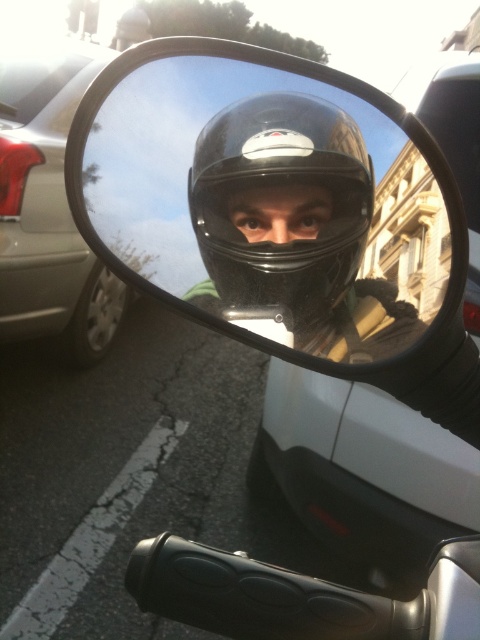
Is point (360, 109) in front of point (264, 218)?

Yes.

Between transparent plastic mirror at center and matte black helmet at center, which one is positioned higher?

transparent plastic mirror at center

What are the coordinates of `transparent plastic mirror at center` in the screenshot? It's located at (267, 188).

Is transparent plastic mirror at center thinner than black matte helmet at center?

In fact, transparent plastic mirror at center might be wider than black matte helmet at center.

Measure the distance between transparent plastic mirror at center and camera.

13.88 inches

Who is more forward, (157, 138) or (220, 177)?

Point (220, 177) is in front.

At what (x,y) coordinates should I click in order to perform the action: click on transparent plastic mirror at center. Please return your answer as a coordinate pair (x, y). Image resolution: width=480 pixels, height=640 pixels. Looking at the image, I should click on (267, 188).

Is metallic silver car at left smaller than matte black helmet at center?

Actually, metallic silver car at left might be larger than matte black helmet at center.

Can you confirm if metallic silver car at left is bigger than matte black helmet at center?

Yes, metallic silver car at left is bigger than matte black helmet at center.

Is point (49, 250) positioned behind point (307, 202)?

That is True.

At what (x,y) coordinates should I click in order to perform the action: click on metallic silver car at left. Please return your answer as a coordinate pair (x, y). The image size is (480, 640). Looking at the image, I should click on (48, 208).